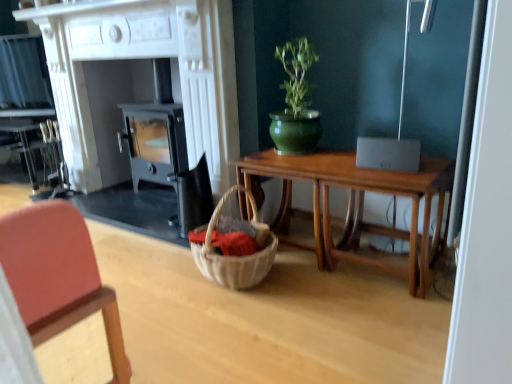
Question: Are white wood fireplace at center and green glossy vase at upper center beside each other?

Choices:
 (A) yes
 (B) no

Answer: (B)

Question: Could you tell me if white wood fireplace at center is turned towards green glossy vase at upper center?

Choices:
 (A) no
 (B) yes

Answer: (A)

Question: Considering the relative sizes of white wood fireplace at center and green glossy vase at upper center in the image provided, is white wood fireplace at center shorter than green glossy vase at upper center?

Choices:
 (A) yes
 (B) no

Answer: (B)

Question: From the image's perspective, is white wood fireplace at center below green glossy vase at upper center?

Choices:
 (A) no
 (B) yes

Answer: (A)

Question: Can you confirm if white wood fireplace at center is positioned to the right of green glossy vase at upper center?

Choices:
 (A) no
 (B) yes

Answer: (A)

Question: Considering the relative sizes of white wood fireplace at center and green glossy vase at upper center in the image provided, is white wood fireplace at center wider than green glossy vase at upper center?

Choices:
 (A) no
 (B) yes

Answer: (B)

Question: Is wooden table at center bigger than green glossy vase at upper center?

Choices:
 (A) no
 (B) yes

Answer: (B)

Question: Considering the relative sizes of wooden table at center and green glossy vase at upper center in the image provided, is wooden table at center thinner than green glossy vase at upper center?

Choices:
 (A) yes
 (B) no

Answer: (B)

Question: Can you confirm if wooden table at center is positioned to the left of green glossy vase at upper center?

Choices:
 (A) no
 (B) yes

Answer: (A)

Question: Is wooden table at center further to the viewer compared to green glossy vase at upper center?

Choices:
 (A) yes
 (B) no

Answer: (B)

Question: Is wooden table at center looking in the opposite direction of green glossy vase at upper center?

Choices:
 (A) no
 (B) yes

Answer: (A)

Question: Can you see wooden table at center touching green glossy vase at upper center?

Choices:
 (A) no
 (B) yes

Answer: (A)

Question: Is wooden table at center a part of white wood fireplace at center?

Choices:
 (A) yes
 (B) no

Answer: (B)